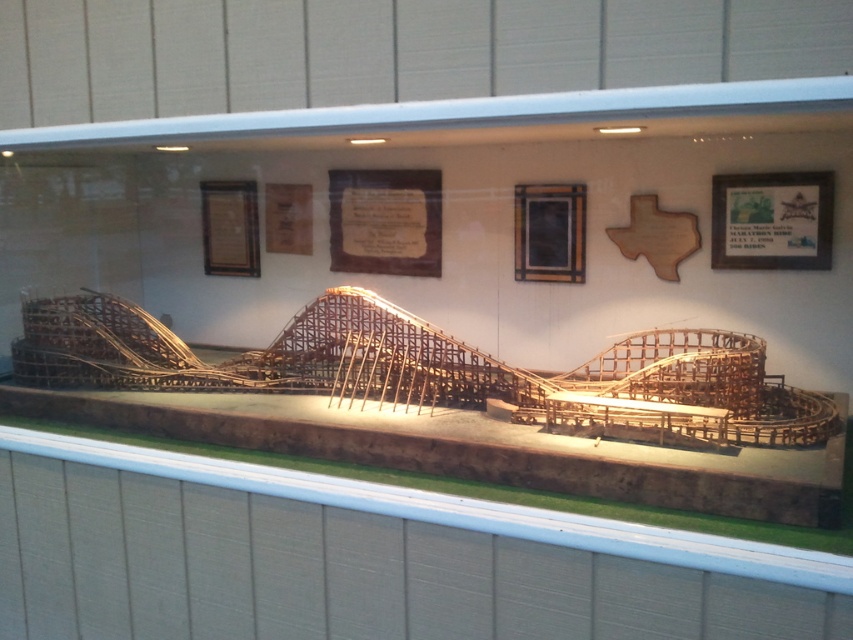
Question: Is wooden plaque at upper right positioned behind wooden frame at center?

Choices:
 (A) no
 (B) yes

Answer: (A)

Question: Considering the relative positions of matte wood plaque at center and wooden plaque at upper right in the image provided, where is matte wood plaque at center located with respect to wooden plaque at upper right?

Choices:
 (A) above
 (B) below

Answer: (A)

Question: Which object is the farthest from the wooden plaque at upper right?

Choices:
 (A) matte wood plaque at center
 (B) wooden frame at center

Answer: (A)

Question: Which of the following is the closest to the observer?

Choices:
 (A) wooden plaque at upper right
 (B) wooden frame at center

Answer: (A)

Question: Which of the following is the farthest from the observer?

Choices:
 (A) wooden frame at center
 (B) wooden plaque at upper right
 (C) matte wood plaque at center

Answer: (C)

Question: Does wooden plaque at upper right have a greater width compared to wooden frame at center?

Choices:
 (A) yes
 (B) no

Answer: (A)